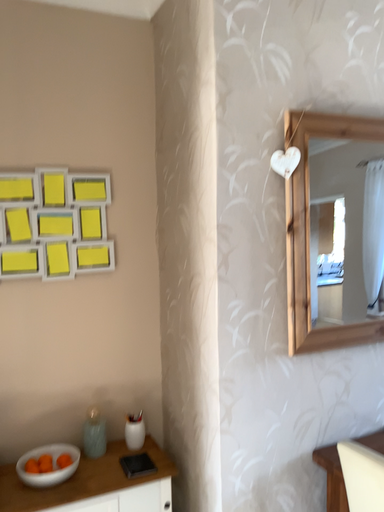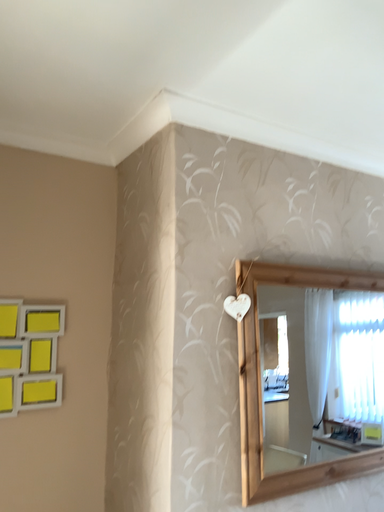
Question: How did the camera likely rotate when shooting the video?

Choices:
 (A) rotated right
 (B) rotated left

Answer: (A)